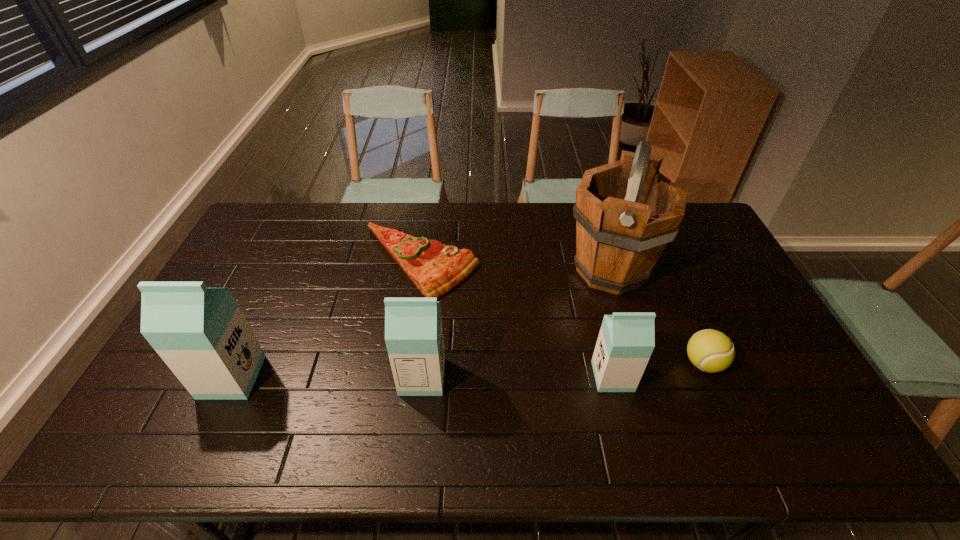
Image resolution: width=960 pixels, height=540 pixels. Find the location of `vacant space located 0.210m on the left of the shortest milk carton`. vacant space located 0.210m on the left of the shortest milk carton is located at coordinates (516, 376).

Find the location of `blank space located on the left of the bucket`. blank space located on the left of the bucket is located at coordinates (x=491, y=271).

Locate an element on the screen. The image size is (960, 540). free location located 0.120m on the left of the pizza is located at coordinates (324, 262).

Where is `vacant space situated on the back of the tennis ball`? The image size is (960, 540). vacant space situated on the back of the tennis ball is located at coordinates (685, 322).

At what (x,y) coordinates should I click in order to perform the action: click on bucket located in the far edge section of the desktop. Please return your answer as a coordinate pair (x, y). The image size is (960, 540). Looking at the image, I should click on (626, 212).

You are a GUI agent. You are given a task and a screenshot of the screen. Output one action in this format:
    pyautogui.click(x=<x>, y=<y>)
    Task: Click on the pizza located at the far edge
    
    Given the screenshot: What is the action you would take?
    pos(435,268)

Image resolution: width=960 pixels, height=540 pixels. I want to click on object that is at the left edge, so click(x=201, y=334).

Identify the location of object that is at the near left corner. (201, 334).

In the image, there is a desktop. Where is `vacant space at the far edge`? This screenshot has height=540, width=960. vacant space at the far edge is located at coordinates [449, 240].

This screenshot has height=540, width=960. I want to click on vacant space at the left edge of the desktop, so click(272, 269).